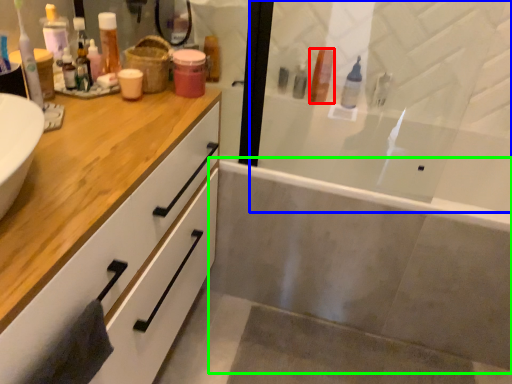
Question: Estimate the real-world distances between objects in this image. Which object is closer to toiletry (highlighted by a red box), screen door (highlighted by a blue box) or bath (highlighted by a green box)?

Choices:
 (A) screen door
 (B) bath

Answer: (A)